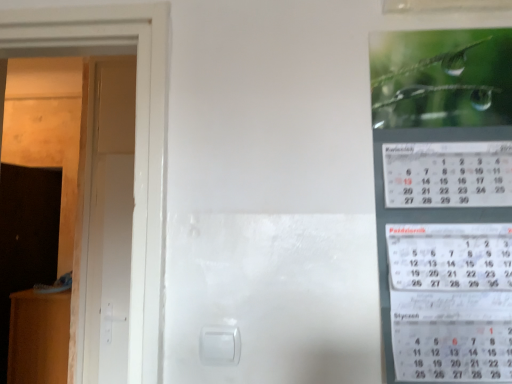
The height and width of the screenshot is (384, 512). What do you see at coordinates (444, 202) in the screenshot? I see `green glossy calendar at upper right` at bounding box center [444, 202].

I want to click on green glossy calendar at upper right, so click(444, 202).

Locate an element on the screen. Image resolution: width=512 pixels, height=384 pixels. green glossy calendar at upper right is located at coordinates (444, 202).